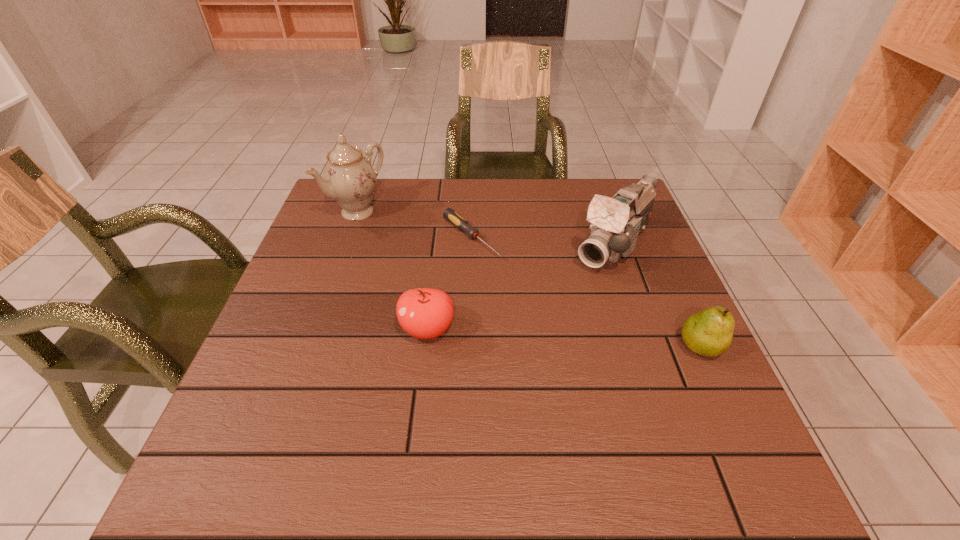
Find the location of a particular element. The width and height of the screenshot is (960, 540). free spot on the desktop that is between the apple and the pear and is positioned insert the shortest object into a screw head is located at coordinates (597, 340).

Where is `free space on the desktop that is between the apple and the pear and is positioned on the spout of the tallest object`? free space on the desktop that is between the apple and the pear and is positioned on the spout of the tallest object is located at coordinates (544, 337).

Identify the location of free space on the desktop that is between the apple and the pear and is positioned on the front-facing side of the fourth shortest object. The image size is (960, 540). (531, 336).